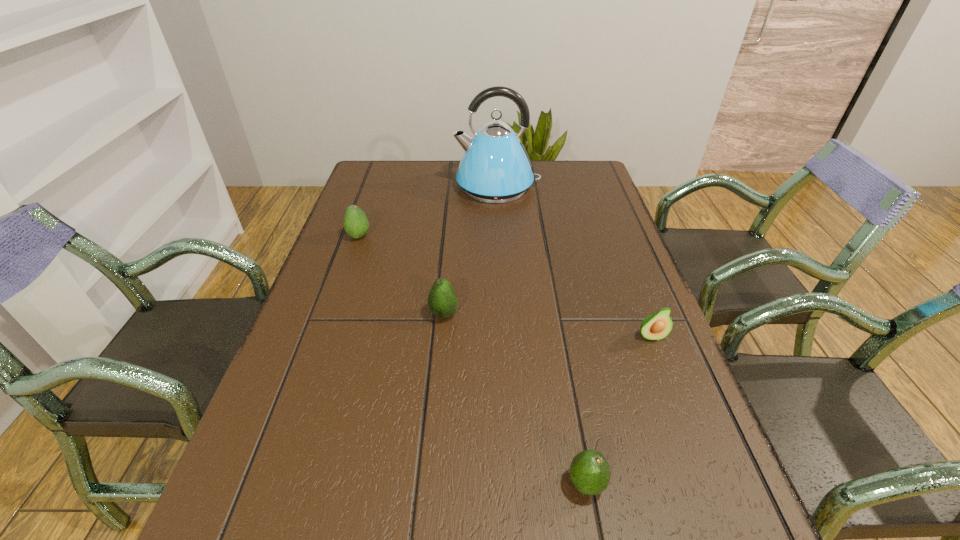
Image resolution: width=960 pixels, height=540 pixels. I want to click on the farthest object, so click(x=495, y=168).

This screenshot has height=540, width=960. Identify the location of the tallest object. (495, 168).

You are a GUI agent. You are given a task and a screenshot of the screen. Output one action in this format:
    pyautogui.click(x=<x>, y=<y>)
    Task: Click on the leftmost object
    Image resolution: width=960 pixels, height=540 pixels.
    Given the screenshot: What is the action you would take?
    pyautogui.click(x=356, y=224)

The width and height of the screenshot is (960, 540). What are the coordinates of `the fourth nearest object` in the screenshot? It's located at (356, 224).

Where is `the second avocado from left to right`? This screenshot has width=960, height=540. the second avocado from left to right is located at coordinates (442, 300).

I want to click on the second farthest avocado, so click(442, 300).

Locate an element on the screen. This screenshot has height=540, width=960. the rightmost object is located at coordinates (657, 326).

Locate an element on the screen. the rightmost avocado is located at coordinates (657, 326).

Where is `the third avocado from left to right`? the third avocado from left to right is located at coordinates click(590, 473).

The width and height of the screenshot is (960, 540). What are the coordinates of `the nearest avocado` in the screenshot? It's located at (590, 473).